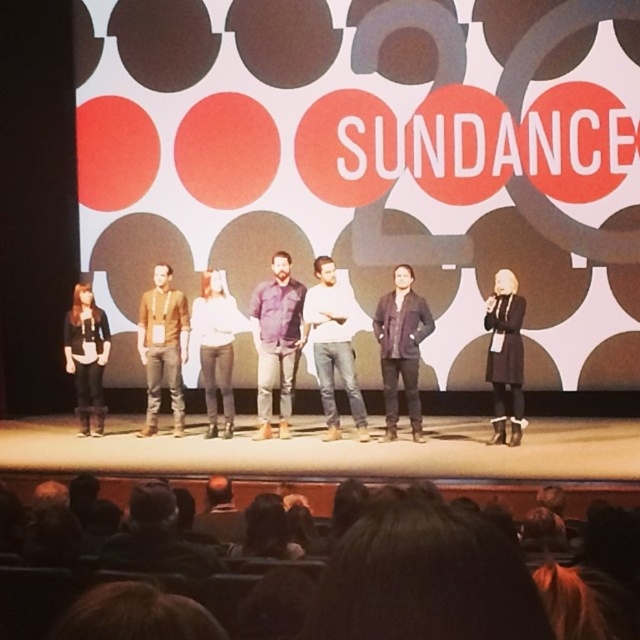
You are organizing a photo shoot and need to arrange two shirts on a mannequin. The purple cotton shirt at center and the white cotton shirt at center must be placed side by side. Which shirt should you place on the left to ensure they fit within a 1.2 meter wide display area?

The purple cotton shirt at center has a lesser width compared to the white cotton shirt at center. To fit both shirts within the 1.2 meter display area, place the narrower purple cotton shirt at center on the left and the wider white cotton shirt at center on the right.

You are organizing a photo shoot and need to ensure that the dark brown leather jacket at center and the white cotton shirt at center can be captured in a single frame. Given that your camera has a maximum frame width of 1.2 meters, will both items fit side by side without overlapping?

The dark brown leather jacket at center is narrower than the white cotton shirt at center. However, without knowing the exact combined width of both items, it is impossible to determine if they will fit within the 1.2 meter frame. Additional measurements are required.

You are attending a panel discussion at Sundance and notice two people wearing cotton shirts at the center of the stage. The purple cotton shirt at center and the white cotton shirt at center. Which one is covering part of the other?

The purple cotton shirt at center is positioned over white cotton shirt at center, so it is covering part of the white cotton shirt at center.